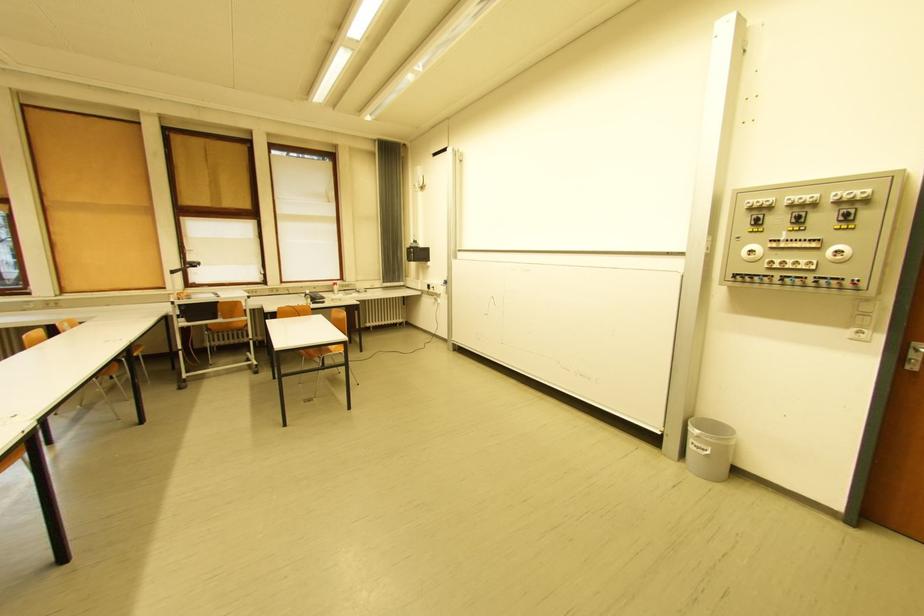
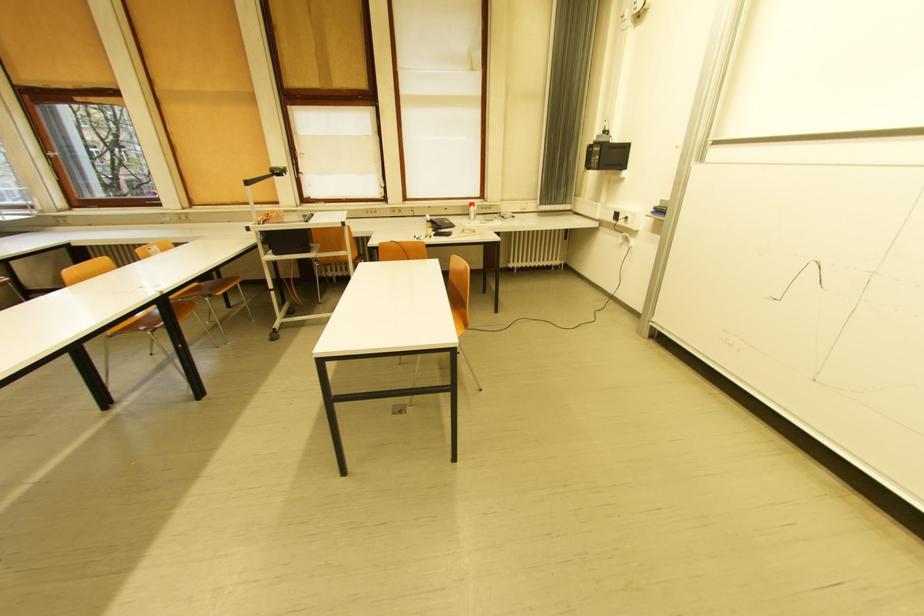
In the second image, find the point that corresponds to (x=334, y=288) in the first image.

(469, 208)